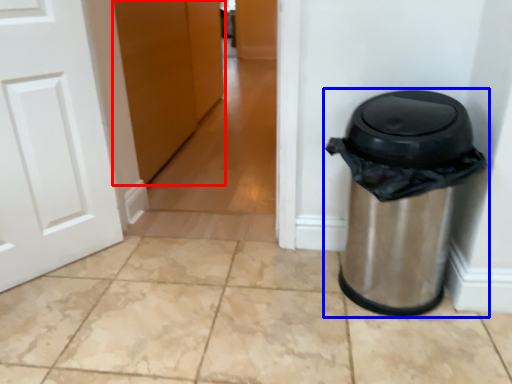
Question: Which object is closer to the camera taking this photo, door (highlighted by a red box) or waste container (highlighted by a blue box)?

Choices:
 (A) door
 (B) waste container

Answer: (B)